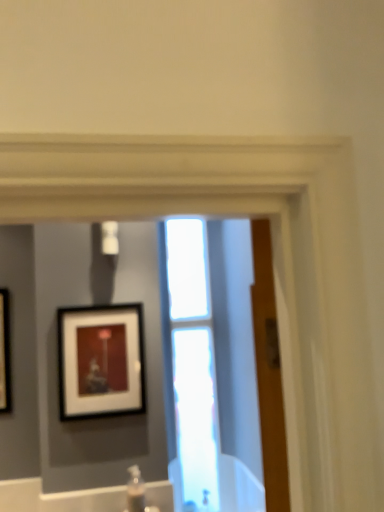
Question: Is clear plastic bottle at lower center in front of or behind transparent glass window at center in the image?

Choices:
 (A) front
 (B) behind

Answer: (A)

Question: In the image, is clear plastic bottle at lower center on the left side or the right side of transparent glass window at center?

Choices:
 (A) right
 (B) left

Answer: (B)

Question: Considering the real-world distances, which object is closest to the transparent glass window at center?

Choices:
 (A) clear plastic bottle at lower center
 (B) matte black picture frame at upper left

Answer: (B)

Question: Which of these objects is positioned farthest from the clear plastic bottle at lower center?

Choices:
 (A) transparent glass window at center
 (B) matte black picture frame at upper left

Answer: (A)